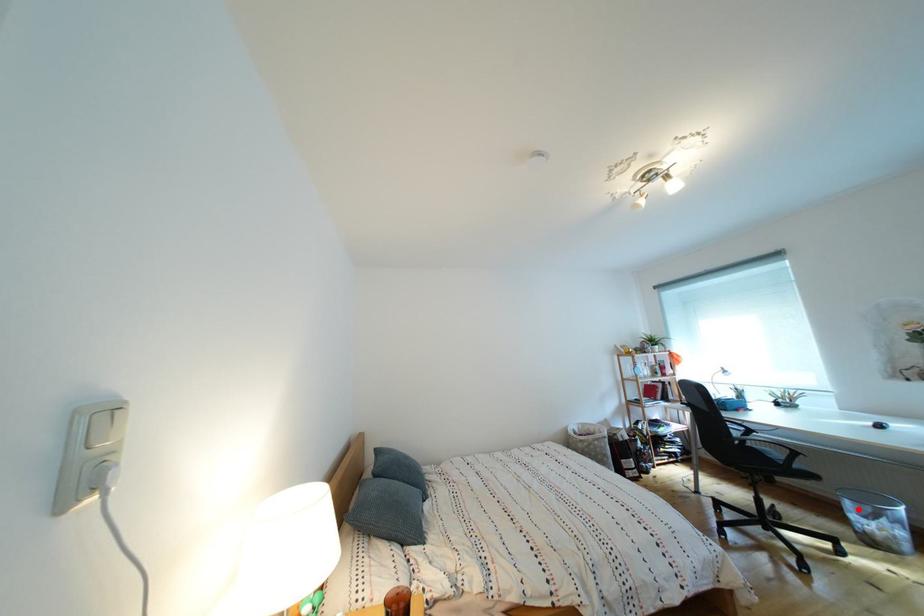
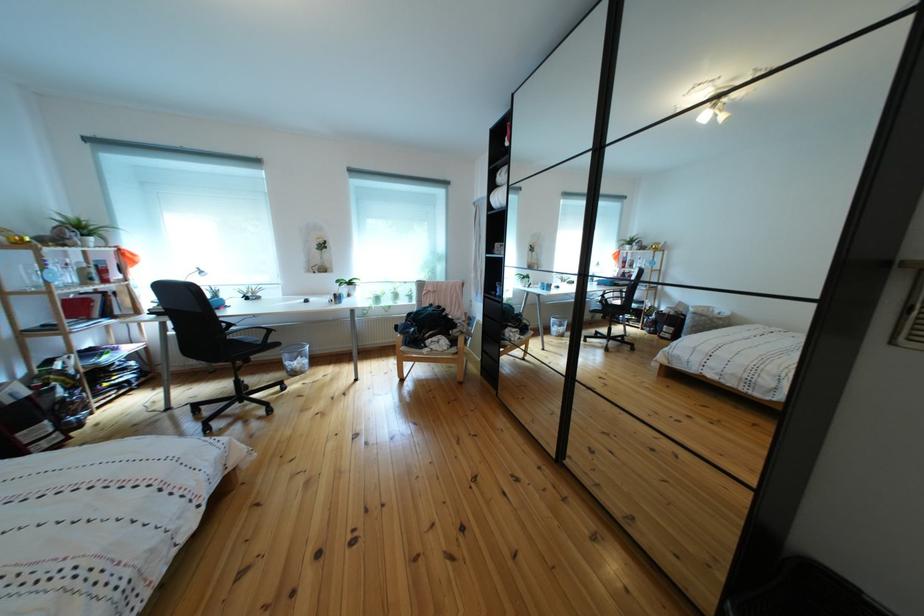
The point at the highlighted location is marked in the first image. Where is the corresponding point in the second image?

(297, 362)